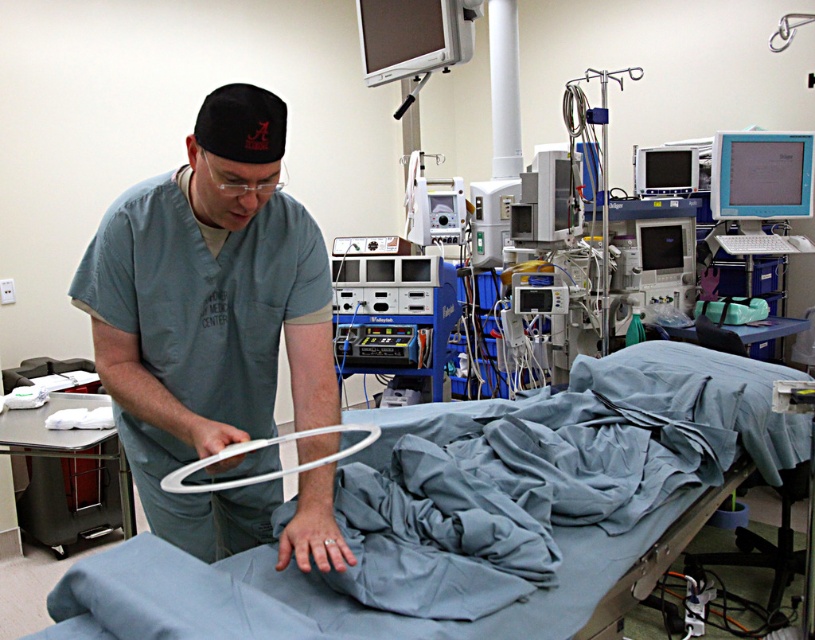
You are a medical student observing a procedure in the hospital. You notice two items in the scene described as smooth blue fabric at center and gray matte scrubs at center. Based on their sizes, which one do you think would require more space to store?

The smooth blue fabric at center requires more storage space because its width is larger than that of the gray matte scrubs at center.

You are a medical student observing a procedure in the hospital. You notice two items at the center of the image. One is the smooth blue fabric at center and the other is the white plastic ring at center. Which one is closer to you?

The smooth blue fabric at center is closer to you since it is in front of the white plastic ring at center.